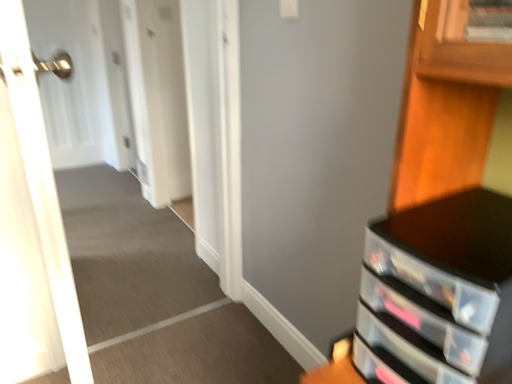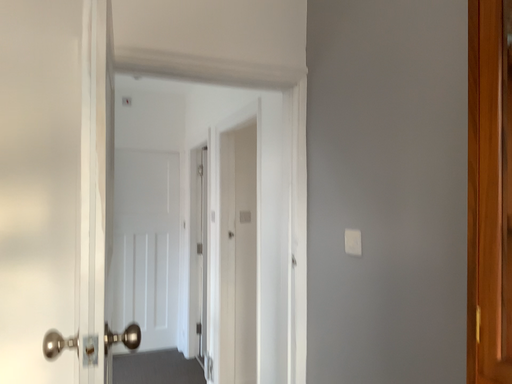
Question: Which way did the camera rotate in the video?

Choices:
 (A) rotated left
 (B) rotated right

Answer: (A)